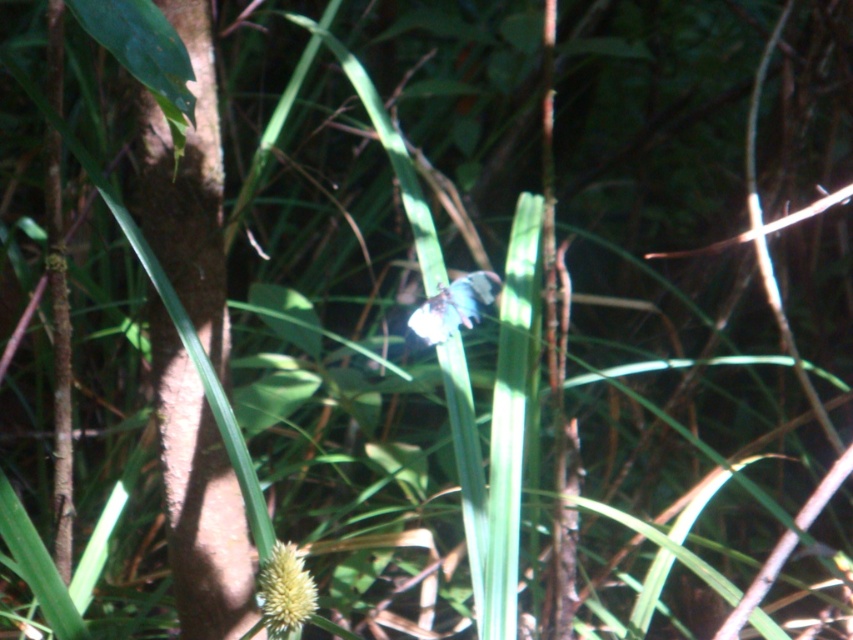
Is white fuzzy flower at center smaller than white matte flower at center?

Yes.

Does point (294, 596) come behind point (463, 278)?

No, it is not.

Locate an element on the screen. Image resolution: width=853 pixels, height=640 pixels. white fuzzy flower at center is located at coordinates (283, 593).